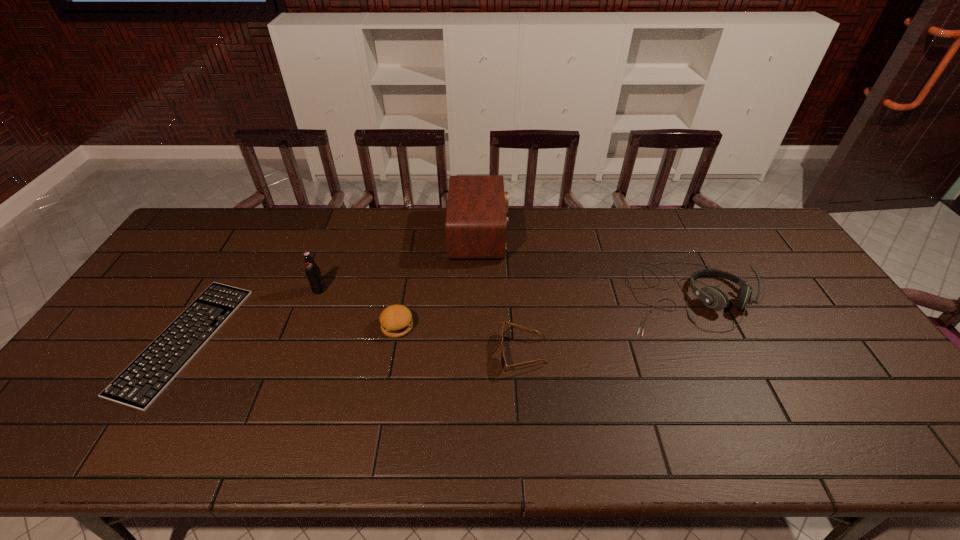
Where is `free point located 0.140m on the front label of the pop`? This screenshot has width=960, height=540. free point located 0.140m on the front label of the pop is located at coordinates (304, 332).

Locate an element on the screen. The image size is (960, 540). vacant space positioned on the outer surface of the rightmost object is located at coordinates (746, 423).

Identify the location of vacant space located 0.200m on the front of the hamburger. (383, 406).

Image resolution: width=960 pixels, height=540 pixels. Find the location of `free point located 0.130m on the frames of the fifth tallest object`. free point located 0.130m on the frames of the fifth tallest object is located at coordinates click(450, 353).

I want to click on vacant space located 0.090m on the frames of the fifth tallest object, so click(x=466, y=353).

The width and height of the screenshot is (960, 540). I want to click on vacant space located on the frames of the fifth tallest object, so 443,353.

At what (x,y) coordinates should I click in order to perform the action: click on free region located 0.250m on the right of the shortest object. Please return your answer as a coordinate pair (x, y). The height and width of the screenshot is (540, 960). Looking at the image, I should click on (321, 340).

You are a GUI agent. You are given a task and a screenshot of the screen. Output one action in this format:
    pyautogui.click(x=<x>, y=<y>)
    Task: Click on the object located at the far edge
    
    Given the screenshot: What is the action you would take?
    pyautogui.click(x=476, y=224)

Identify the location of object located at the left edge. The width and height of the screenshot is (960, 540). (138, 386).

The image size is (960, 540). In the image, there is a desktop. Find the location of `free space at the far edge`. free space at the far edge is located at coordinates [325, 227].